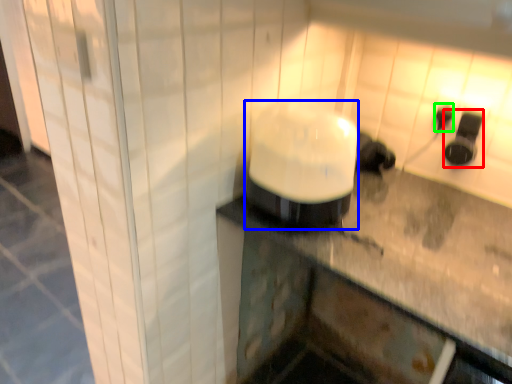
Question: Which object is the farthest from appliance (highlighted by a red box)? Choose among these: appliance (highlighted by a blue box) or electric outlet (highlighted by a green box).

Choices:
 (A) appliance
 (B) electric outlet

Answer: (A)